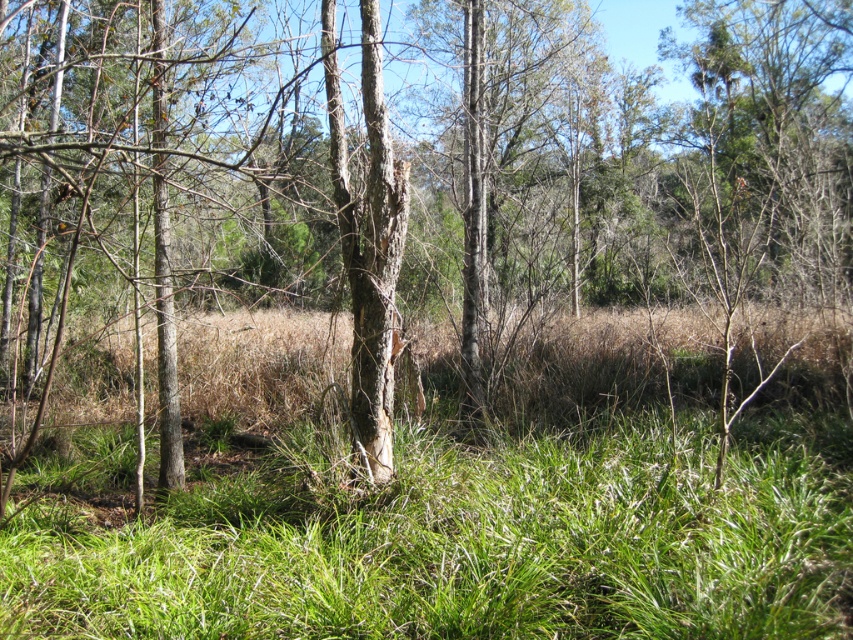
Between green grass at center and smooth bark tree trunk at center, which one is positioned lower?

green grass at center is lower down.

You are a GUI agent. You are given a task and a screenshot of the screen. Output one action in this format:
    pyautogui.click(x=<x>, y=<y>)
    Task: Click on the green grass at center
    Image resolution: width=853 pixels, height=640 pixels.
    Given the screenshot: What is the action you would take?
    pyautogui.click(x=448, y=493)